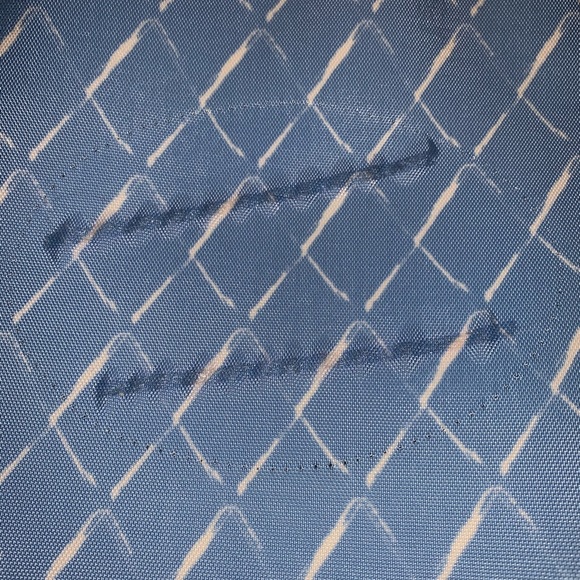
Locate an element on the screen. Image resolution: width=580 pixels, height=580 pixels. texture of blue fabric is located at coordinates (514, 564), (507, 564), (500, 563), (494, 564).